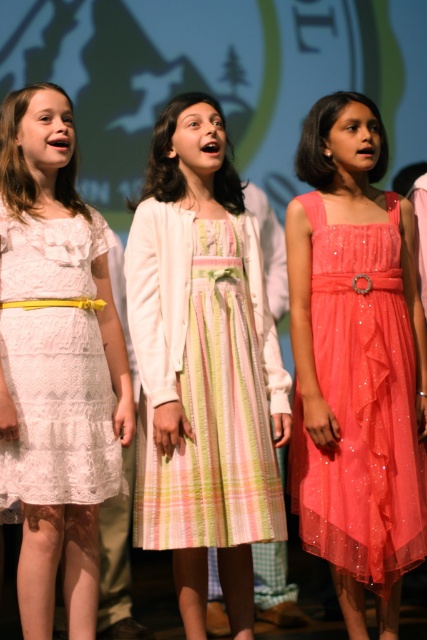
You are an event photographer trying to capture the three girls in the scene. The middle girl is wearing a pastel plaid dress located at point (204, 381). To ensure proper framing, you need to know the exact position of the pastel plaid dress at center. What are the coordinates of the pastel plaid dress at center?

The coordinates of the pastel plaid dress at center are point (204, 381).